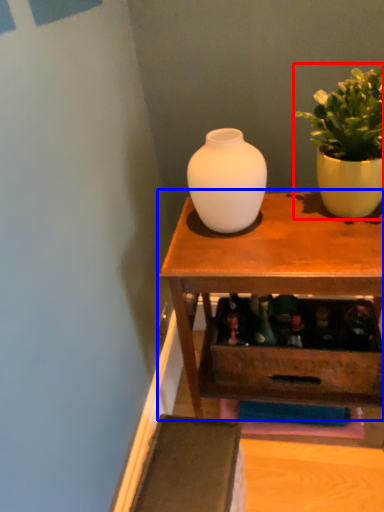
Question: Which object appears closest to the camera in this image, houseplant (highlighted by a red box) or table (highlighted by a blue box)?

Choices:
 (A) houseplant
 (B) table

Answer: (A)